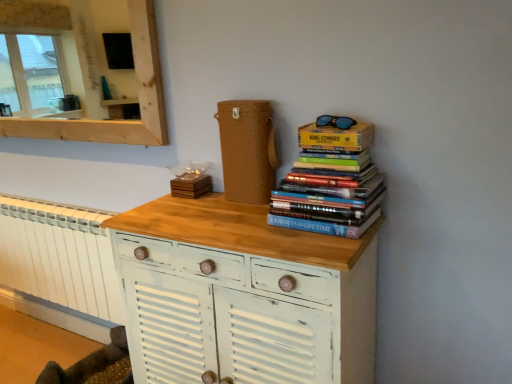
Question: Does wooden mirror at upper left have a greater width compared to wooden coaster at center, acting as the second paperback book starting from the front?

Choices:
 (A) no
 (B) yes

Answer: (B)

Question: From the image's perspective, is wooden mirror at upper left located beneath wooden coaster at center, which is the second paperback book from right to left?

Choices:
 (A) no
 (B) yes

Answer: (A)

Question: Are wooden mirror at upper left and wooden coaster at center, acting as the second paperback book starting from the front, located far from each other?

Choices:
 (A) yes
 (B) no

Answer: (A)

Question: Are wooden mirror at upper left and wooden coaster at center, positioned as the first paperback book in left-to-right order, beside each other?

Choices:
 (A) yes
 (B) no

Answer: (B)

Question: Considering the relative sizes of wooden mirror at upper left and wooden coaster at center, arranged as the 2th paperback book when viewed from the top, in the image provided, is wooden mirror at upper left thinner than wooden coaster at center, arranged as the 2th paperback book when viewed from the top,?

Choices:
 (A) yes
 (B) no

Answer: (B)

Question: Does wooden mirror at upper left have a smaller size compared to wooden coaster at center, the 1th paperback book ordered from the bottom?

Choices:
 (A) no
 (B) yes

Answer: (A)

Question: From a real-world perspective, is wooden mirror at upper left positioned under yellow cardboard box at upper right, the second paperback book positioned from the bottom, based on gravity?

Choices:
 (A) yes
 (B) no

Answer: (B)

Question: From a real-world perspective, is wooden mirror at upper left physically above yellow cardboard box at upper right, arranged as the 2th paperback book when viewed from the back?

Choices:
 (A) no
 (B) yes

Answer: (B)

Question: Is wooden mirror at upper left facing away from yellow cardboard box at upper right, the second paperback book positioned from the bottom?

Choices:
 (A) no
 (B) yes

Answer: (A)

Question: Is wooden mirror at upper left bigger than yellow cardboard box at upper right, positioned as the 2th paperback book in left-to-right order?

Choices:
 (A) yes
 (B) no

Answer: (A)

Question: Is wooden mirror at upper left aimed at yellow cardboard box at upper right, arranged as the 2th paperback book when viewed from the back?

Choices:
 (A) no
 (B) yes

Answer: (A)

Question: Is wooden mirror at upper left far away from yellow cardboard box at upper right, acting as the 1th paperback book starting from the top?

Choices:
 (A) no
 (B) yes

Answer: (B)

Question: Does wooden coaster at center, which is the second paperback book from right to left, have a lesser height compared to wooden mirror at upper left?

Choices:
 (A) no
 (B) yes

Answer: (B)